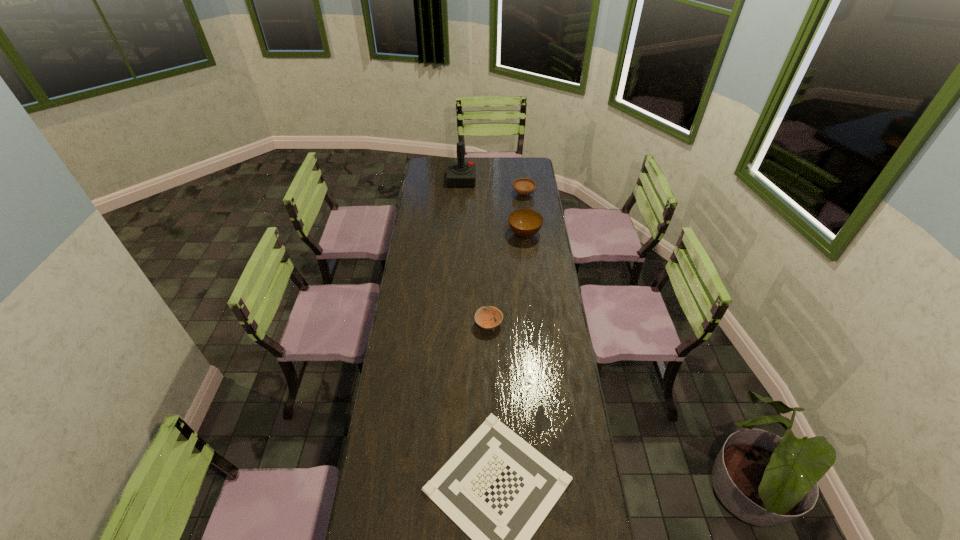
Identify the location of free space that satisfies the following two spatial constraints: 1. on the base of the tallest object; 2. on the left side of the third shortest object. (461, 194).

The height and width of the screenshot is (540, 960). What are the coordinates of `vacant area that satisfies the following two spatial constraints: 1. on the back side of the fourth shortest object; 2. on the base of the tallest object` in the screenshot? It's located at (518, 180).

Locate an element on the screen. This screenshot has height=540, width=960. free space that satisfies the following two spatial constraints: 1. on the base of the third farthest object; 2. on the left side of the joystick is located at coordinates (459, 234).

The height and width of the screenshot is (540, 960). I want to click on free location that satisfies the following two spatial constraints: 1. on the base of the tallest object; 2. on the left side of the fourth farthest object, so click(454, 325).